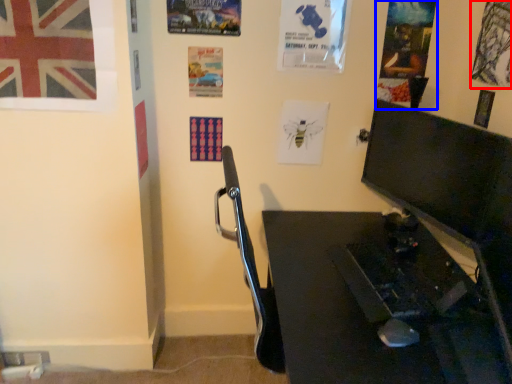
Question: Among these objects, which one is nearest to the camera, poster page (highlighted by a red box) or poster page (highlighted by a blue box)?

Choices:
 (A) poster page
 (B) poster page

Answer: (A)